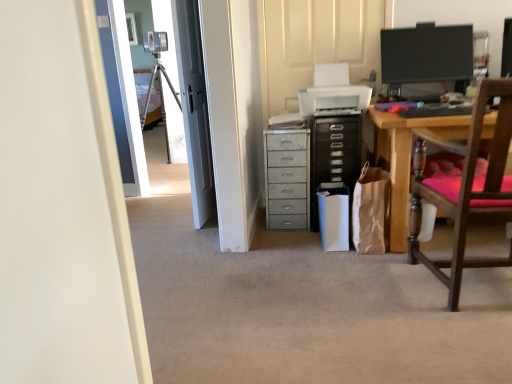
Question: From the image's perspective, is metallic gray chest of drawers at center below black glossy monitor at upper right?

Choices:
 (A) yes
 (B) no

Answer: (A)

Question: Is the surface of metallic gray chest of drawers at center in direct contact with black glossy monitor at upper right?

Choices:
 (A) yes
 (B) no

Answer: (B)

Question: Considering the relative sizes of metallic gray chest of drawers at center and black glossy monitor at upper right in the image provided, is metallic gray chest of drawers at center taller than black glossy monitor at upper right?

Choices:
 (A) yes
 (B) no

Answer: (A)

Question: From the image's perspective, is metallic gray chest of drawers at center on top of black glossy monitor at upper right?

Choices:
 (A) no
 (B) yes

Answer: (A)

Question: Can you confirm if metallic gray chest of drawers at center is bigger than black glossy monitor at upper right?

Choices:
 (A) yes
 (B) no

Answer: (A)

Question: Does metallic gray chest of drawers at center appear on the right side of black glossy monitor at upper right?

Choices:
 (A) no
 (B) yes

Answer: (A)

Question: Is wooden chair with pink cushion at right positioned behind metallic gray chest of drawers at center?

Choices:
 (A) yes
 (B) no

Answer: (B)

Question: From a real-world perspective, is wooden chair with pink cushion at right below metallic gray chest of drawers at center?

Choices:
 (A) yes
 (B) no

Answer: (B)

Question: Is metallic gray chest of drawers at center inside wooden chair with pink cushion at right?

Choices:
 (A) yes
 (B) no

Answer: (B)

Question: Does wooden chair with pink cushion at right appear on the left side of metallic gray chest of drawers at center?

Choices:
 (A) yes
 (B) no

Answer: (B)

Question: Is wooden chair with pink cushion at right taller than metallic gray chest of drawers at center?

Choices:
 (A) yes
 (B) no

Answer: (A)

Question: Does wooden chair with pink cushion at right have a greater width compared to metallic gray chest of drawers at center?

Choices:
 (A) yes
 (B) no

Answer: (A)

Question: Is metallic gray chest of drawers at center facing away from wooden chair with pink cushion at right?

Choices:
 (A) yes
 (B) no

Answer: (B)